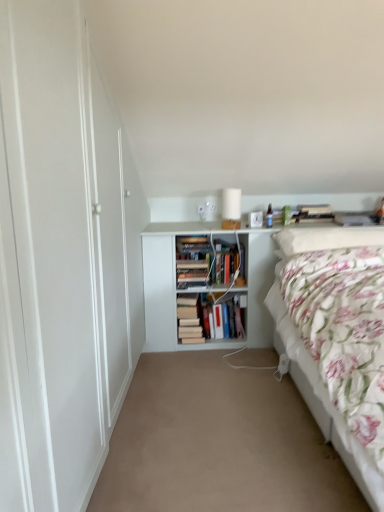
Where is `free region on the left part of white glossy table lamp at center`? The image size is (384, 512). free region on the left part of white glossy table lamp at center is located at coordinates (213, 223).